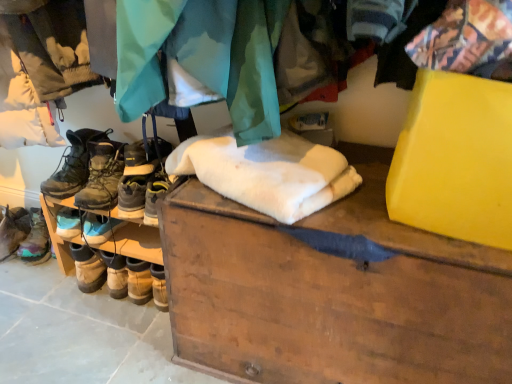
Question: From the image's perspective, is leather hiking boots at left, which is counted as the 2th footwear, starting from the right, on top of wooden chest at center?

Choices:
 (A) yes
 (B) no

Answer: (A)

Question: Is leather hiking boots at left, which is counted as the 2th footwear, starting from the right, placed right next to wooden chest at center?

Choices:
 (A) no
 (B) yes

Answer: (A)

Question: Is leather hiking boots at left, the 3th footwear positioned from the left, further to the viewer compared to wooden chest at center?

Choices:
 (A) yes
 (B) no

Answer: (A)

Question: Can you confirm if leather hiking boots at left, which is counted as the 2th footwear, starting from the right, is shorter than wooden chest at center?

Choices:
 (A) yes
 (B) no

Answer: (A)

Question: Is leather hiking boots at left, which is counted as the 2th footwear, starting from the right, looking in the opposite direction of wooden chest at center?

Choices:
 (A) no
 (B) yes

Answer: (A)

Question: Considering the positions of point (30, 253) and point (297, 160), is point (30, 253) closer or farther from the camera than point (297, 160)?

Choices:
 (A) farther
 (B) closer

Answer: (A)

Question: From a real-world perspective, is leather boots at left, arranged as the first footwear when viewed from the left, above or below white fluffy blanket at center?

Choices:
 (A) below
 (B) above

Answer: (A)

Question: From their relative heights in the image, would you say leather boots at left, acting as the 4th footwear starting from the right, is taller or shorter than white fluffy blanket at center?

Choices:
 (A) short
 (B) tall

Answer: (B)

Question: Is leather boots at left, arranged as the first footwear when viewed from the left, in front of or behind white fluffy blanket at center in the image?

Choices:
 (A) behind
 (B) front

Answer: (A)

Question: Is leather boots at left, acting as the 4th footwear starting from the right, inside the boundaries of leather hiking boots at center, which is the fourth footwear in left-to-right order, or outside?

Choices:
 (A) outside
 (B) inside

Answer: (A)

Question: Visually, is leather boots at left, arranged as the first footwear when viewed from the left, positioned to the left or to the right of leather hiking boots at center, placed as the 1th footwear when sorted from right to left?

Choices:
 (A) left
 (B) right

Answer: (A)

Question: From the image's perspective, is leather boots at left, acting as the 4th footwear starting from the right, located above or below leather hiking boots at center, placed as the 1th footwear when sorted from right to left?

Choices:
 (A) above
 (B) below

Answer: (B)

Question: From a real-world perspective, is leather boots at left, arranged as the first footwear when viewed from the left, positioned above or below leather hiking boots at center, which is the fourth footwear in left-to-right order?

Choices:
 (A) above
 (B) below

Answer: (B)

Question: From their relative heights in the image, would you say leather hiking boots at left, the 3th footwear positioned from the left, is taller or shorter than leather boots at left, acting as the 4th footwear starting from the right?

Choices:
 (A) tall
 (B) short

Answer: (A)

Question: From a real-world perspective, is leather hiking boots at left, the 3th footwear positioned from the left, physically located above or below leather boots at left, acting as the 4th footwear starting from the right?

Choices:
 (A) below
 (B) above

Answer: (B)